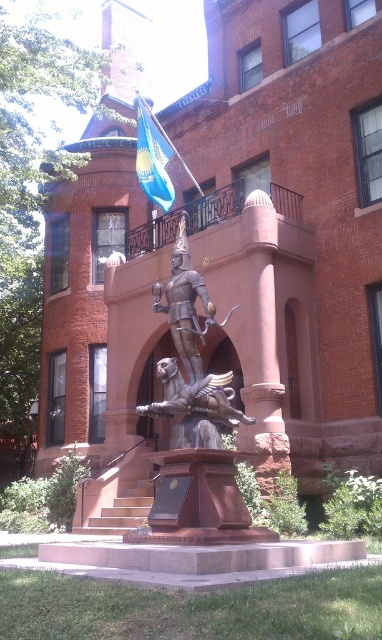
You are standing at the entrance of the red brick building and want to take a photo of the polished bronze statue at center. Where should you position yourself to capture the statue in the center of your camera frame?

You should position yourself directly in front of the polished bronze statue at center at point (191, 358) to ensure it is centered in your camera frame.

You are a visitor standing in front of the building. You see the polished bronze statue at center and the blue fabric flag at upper center. Which object is higher up in the image?

The blue fabric flag at upper center is higher up in the image than the polished bronze statue at center.